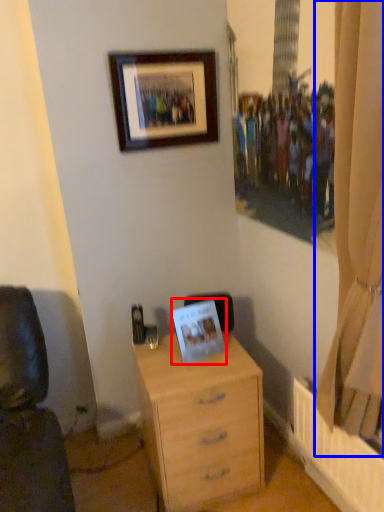
Question: Which of the following is the farthest to the observer, picture frame (highlighted by a red box) or curtain (highlighted by a blue box)?

Choices:
 (A) picture frame
 (B) curtain

Answer: (A)